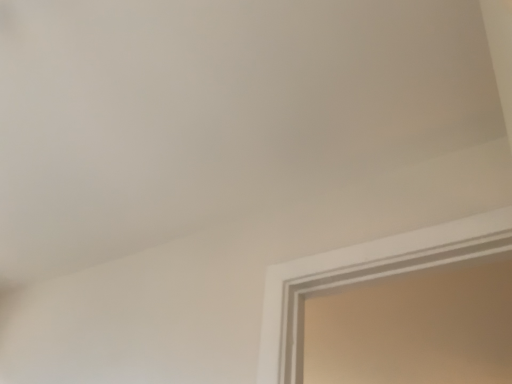
What do you see at coordinates (362, 279) in the screenshot? I see `white plastic window at lower right` at bounding box center [362, 279].

Where is `white plastic window at lower right`? white plastic window at lower right is located at coordinates (362, 279).

In the scene shown: What is the approximate width of white plastic window at lower right?

6.00 feet.

Find the location of a particular element. The width and height of the screenshot is (512, 384). white plastic window at lower right is located at coordinates (362, 279).